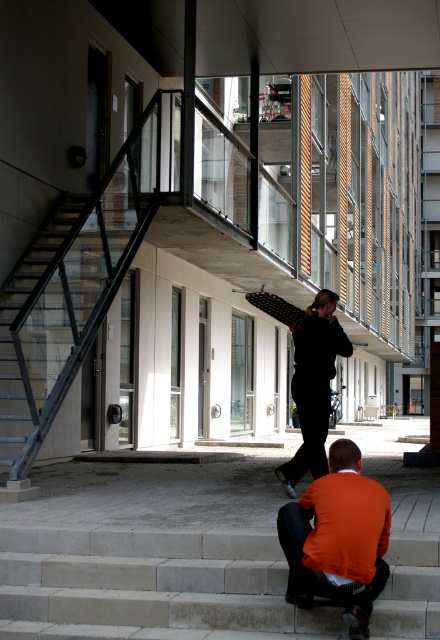
You are standing at the bottom of the concrete steps at lower center and want to reach the entrance. The black matte pants at center is moving towards the top of the steps. Which object is closer to you?

The concrete steps at lower center are closer to you since they are the structure you are standing on, while the black matte pants at center is moving upwards away from you.

You are trying to decide whether to place a small potted plant on the concrete steps at lower center or the orange sweater at lower center. Based on their sizes, which surface would be more appropriate for placing the plant?

The concrete steps at lower center has a larger size compared to orange sweater at lower center, so the concrete steps at lower center would be more appropriate for placing the plant.

You are a delivery person carrying a package that requires a clear path of at least 2 meters to navigate. You see the concrete steps at lower center and the black matte pants at center. Can you safely pass between them without obstructing the path?

The concrete steps at lower center and black matte pants at center are 2.22 meters apart, which is more than the required 2 meters. Therefore, you can safely pass between them without obstructing the path.